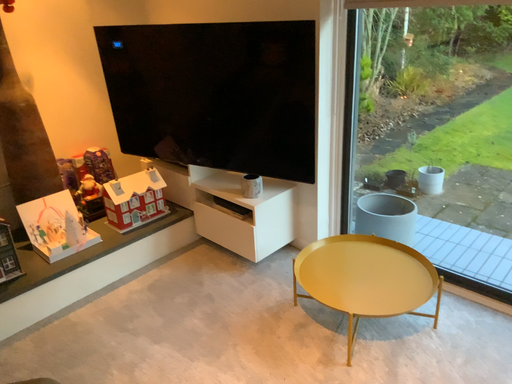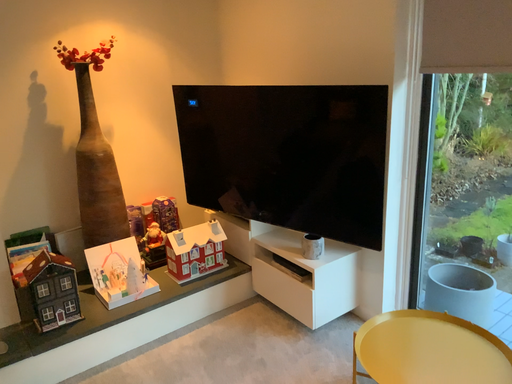
Question: How did the camera likely rotate when shooting the video?

Choices:
 (A) rotated upward
 (B) rotated downward

Answer: (A)